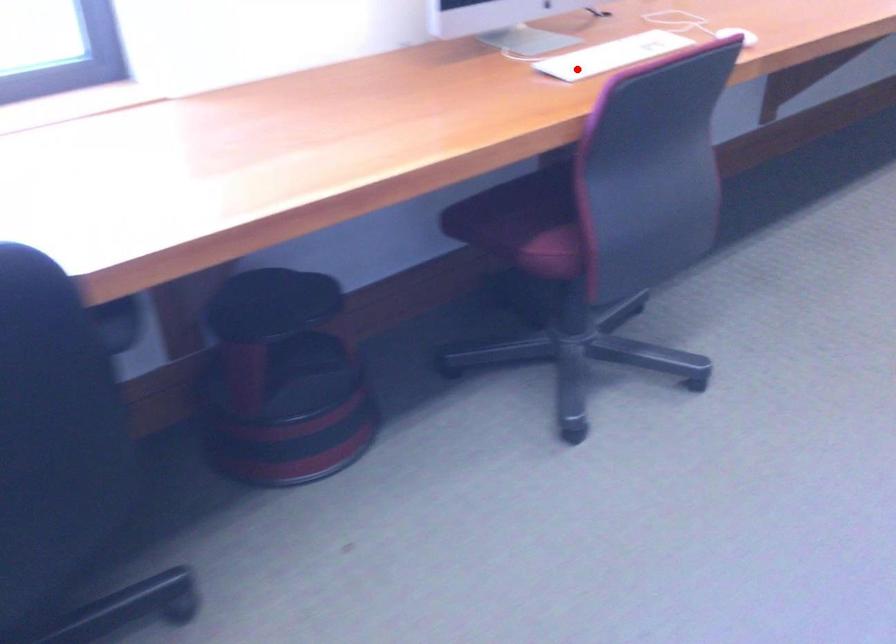
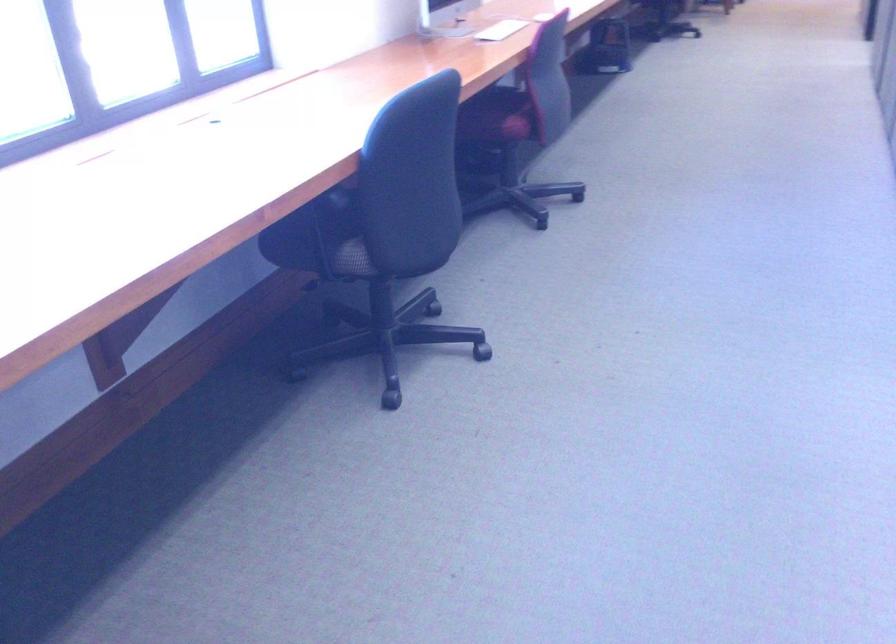
The point at the highlighted location is marked in the first image. Where is the corresponding point in the second image?

(501, 30)